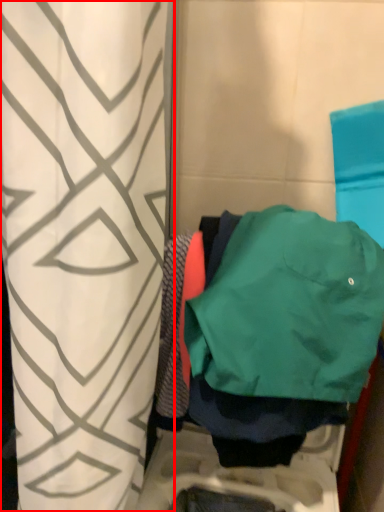
Question: From the image's perspective, what is the correct spatial relationship of curtain (annotated by the red box) in relation to jacket?

Choices:
 (A) above
 (B) below

Answer: (B)